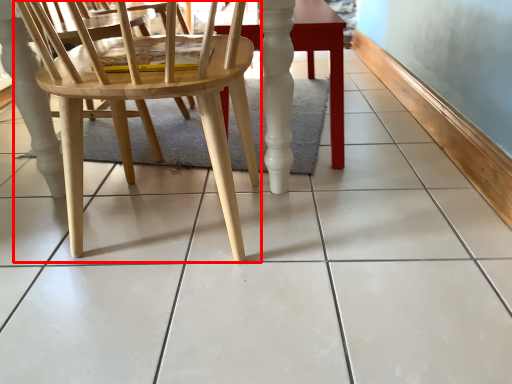
Question: Considering the relative positions of chair (annotated by the red box) and table in the image provided, where is chair (annotated by the red box) located with respect to the staircase?

Choices:
 (A) left
 (B) right

Answer: (A)